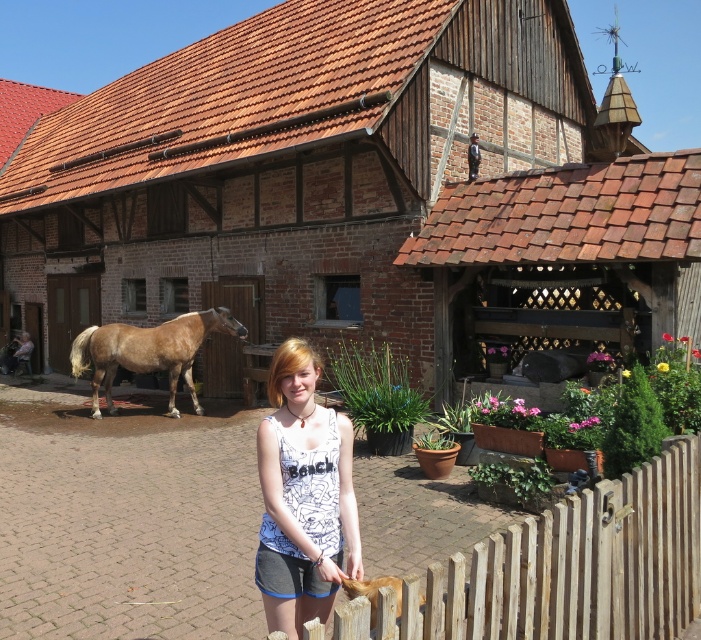
Question: Is brown wooden barn at center thinner than white printed tank top at center?

Choices:
 (A) no
 (B) yes

Answer: (A)

Question: Can you confirm if brown wooden barn at center is positioned to the right of light brown wooden fence at lower right?

Choices:
 (A) yes
 (B) no

Answer: (B)

Question: Is brown wooden barn at center to the left of light brown wooden fence at lower right from the viewer's perspective?

Choices:
 (A) no
 (B) yes

Answer: (B)

Question: Which is nearer to the light brown wooden fence at lower right?

Choices:
 (A) brown glossy horse at center
 (B) white printed tank top at center
 (C) brown wooden barn at center

Answer: (B)

Question: Which object is positioned farthest from the brown wooden barn at center?

Choices:
 (A) brown glossy horse at center
 (B) light brown wooden fence at lower right
 (C) white printed tank top at center

Answer: (C)

Question: Which point appears farthest from the camera in this image?

Choices:
 (A) 669,522
 (B) 83,342

Answer: (B)